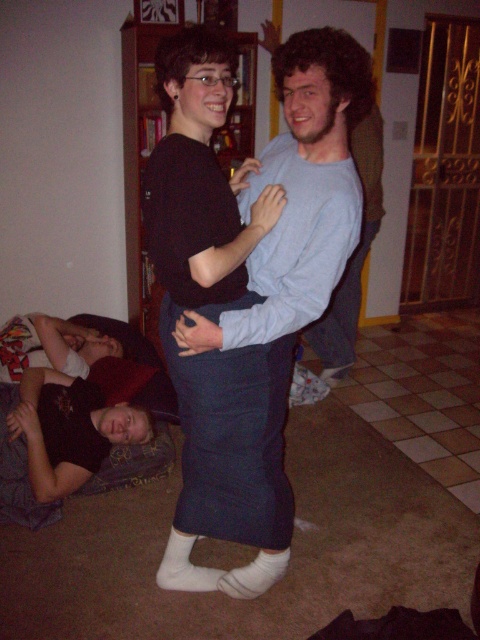
Can you confirm if black matte skirt at center is smaller than white cotton sock at lower center?

Incorrect, black matte skirt at center is not smaller in size than white cotton sock at lower center.

Is point (240, 380) farther from viewer compared to point (257, 593)?

No, (240, 380) is in front of (257, 593).

This screenshot has width=480, height=640. In order to click on black matte skirt at center in this screenshot , I will do [x=213, y=317].

Who is more forward, (197,236) or (159,584)?

Point (197,236)

Who is shorter, black matte skirt at center or white cotton socks at lower center?

Standing shorter between the two is white cotton socks at lower center.

Locate an element on the screen. The width and height of the screenshot is (480, 640). black matte skirt at center is located at coordinates (213, 317).

Who is more distant from viewer, (x=67, y=406) or (x=192, y=538)?

The point (x=67, y=406) is more distant.

Locate an element on the screen. This screenshot has width=480, height=640. black cotton shirt at lower left is located at coordinates (69, 429).